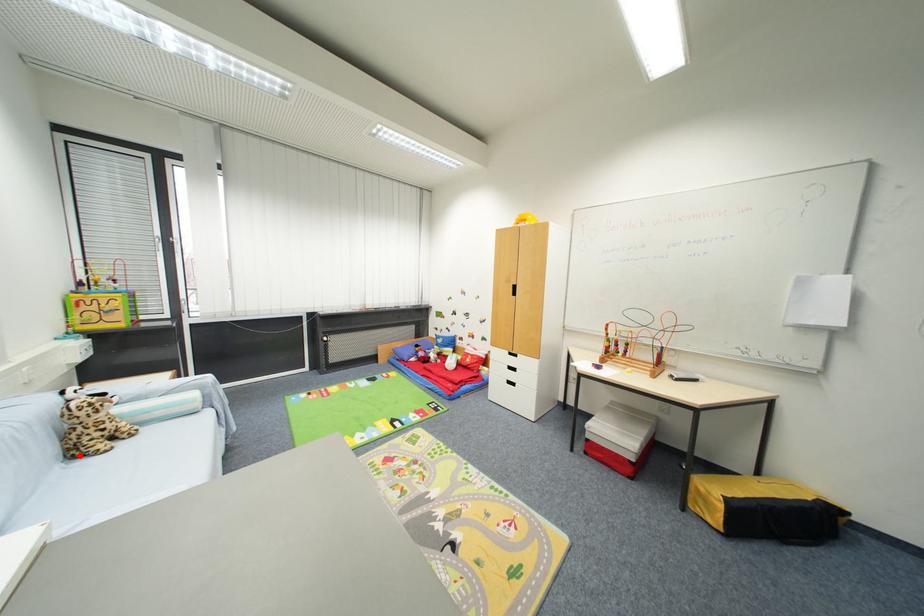
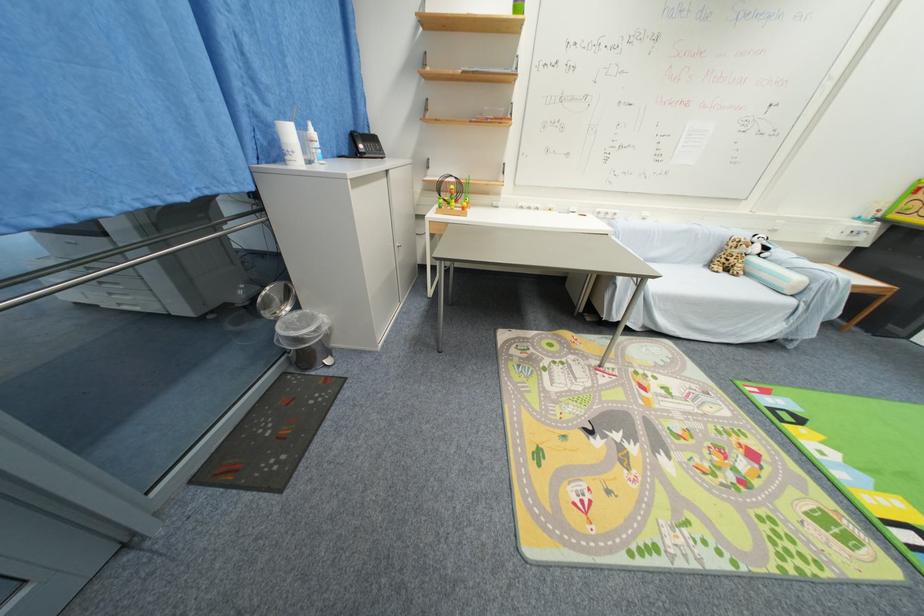
The point at the highlighted location is marked in the first image. Where is the corresponding point in the second image?

(714, 265)